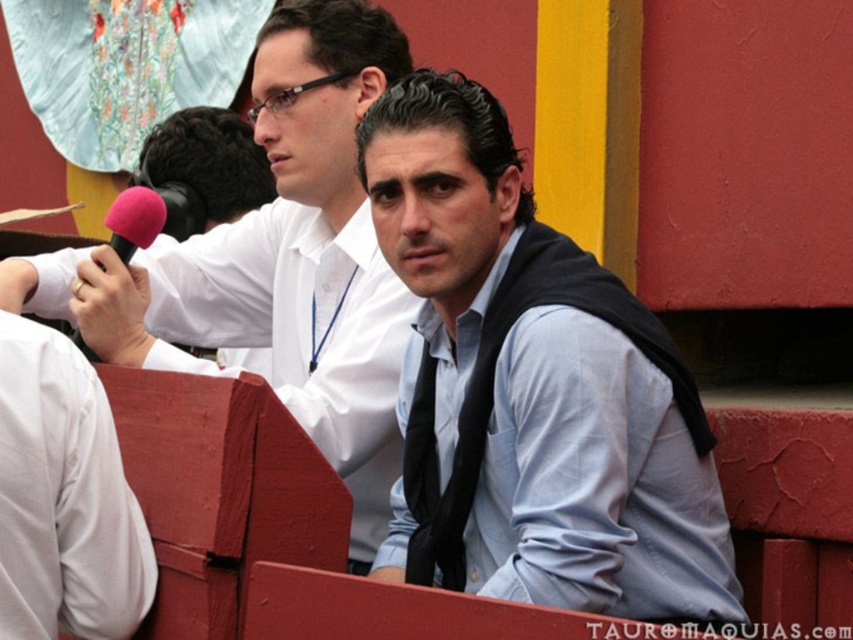
You are a photographer positioned behind the two people seated on the red wooden structure. You want to capture a clear closeup of the matte black tie at center without the pink fabric microphone at upper left blocking it. Is this possible given their positions?

The matte black tie at center is closer to the viewer than the pink fabric microphone at upper left, so the tie would block the microphone in a closeup shot. Therefore, capturing a clear closeup of the tie without the microphone blocking it is not possible.

You are a photographer standing at the origin point of the coordinate system. You want to take a photo of the light blue shirt at center. What are the coordinates where you should aim your camera?

The coordinates you should aim your camera at are point (531, 388).

You are a photographer trying to capture a closeup of the matte black tie at center and the pink fabric microphone at upper left. Since you want both items to appear similarly sized in the photo, which object should you move closer to the camera?

The pink fabric microphone at upper left should be moved closer to the camera because its actual width is smaller than the matte black tie at center. To make them appear the same size in the photo, the smaller object needs to be positioned nearer to the camera.